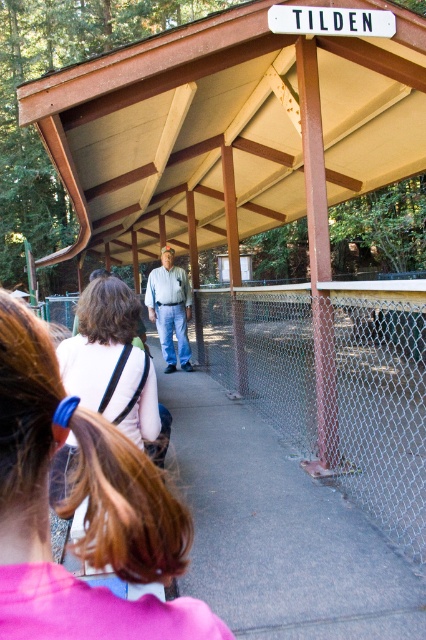
You are standing at the point marked by the coordinates point (230,129). What object are you directly under?

The point (230,129) indicates wooden roof at center, so you are directly under the wooden roof at center.